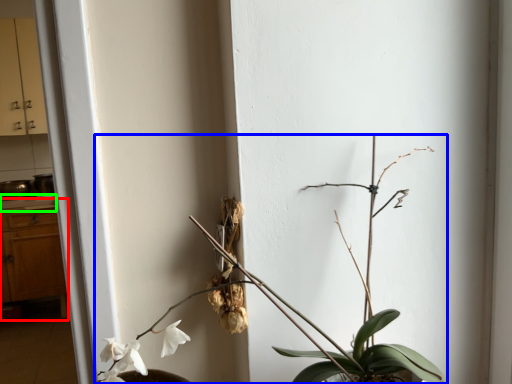
Question: Which is nearer to the dresser (highlighted by a red box)? houseplant (highlighted by a blue box) or counter top (highlighted by a green box).

Choices:
 (A) houseplant
 (B) counter top

Answer: (B)